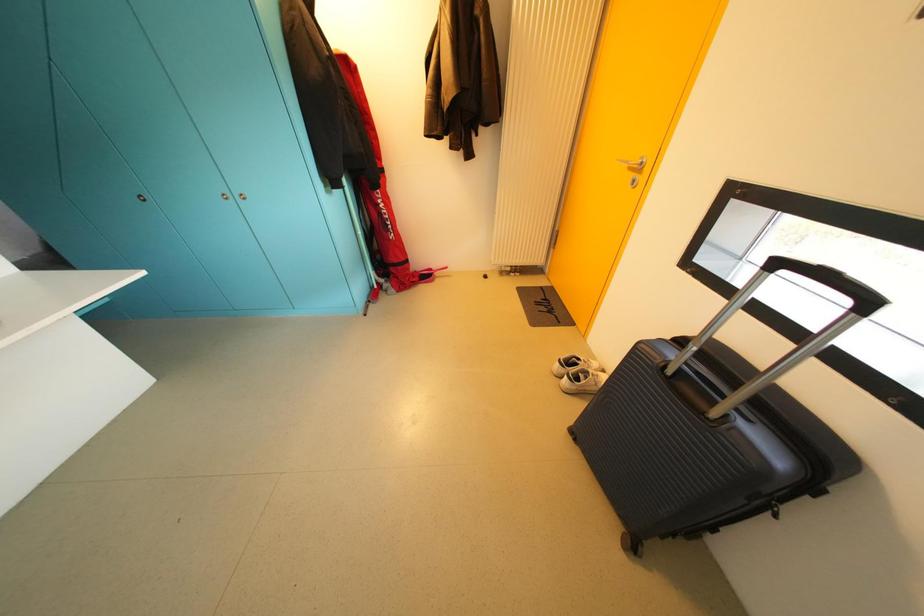
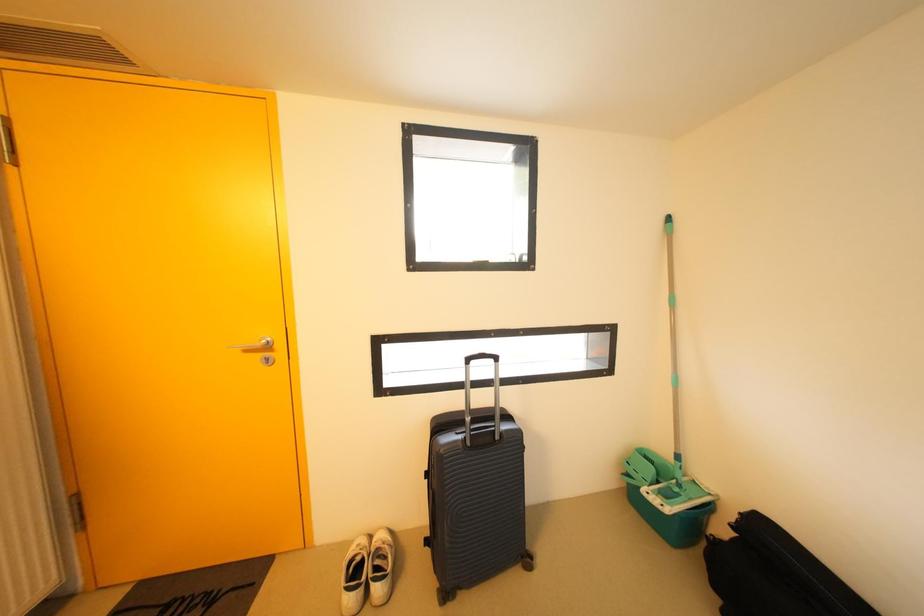
Question: The camera is either moving clockwise (left) or counter-clockwise (right) around the object. The first image is from the beginning of the video and the second image is from the end. Is the camera moving left or right when shooting the video?

Choices:
 (A) Left
 (B) Right

Answer: (A)